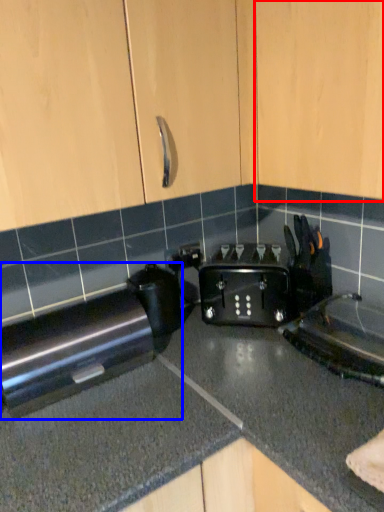
Question: Which object appears closest to the camera in this image, cabinetry (highlighted by a red box) or home appliance (highlighted by a blue box)?

Choices:
 (A) cabinetry
 (B) home appliance

Answer: (A)